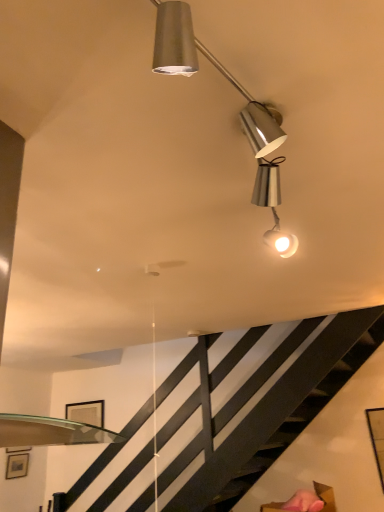
What is the approximate width of metallic silver lamp at upper center?

8.19 inches.

At what (x,y) coordinates should I click in order to perform the action: click on matte black picture frame at lower left, acting as the second picture frame starting from the right. Please return your answer as a coordinate pair (x, y). This screenshot has width=384, height=512. Looking at the image, I should click on (17, 465).

This screenshot has height=512, width=384. What are the coordinates of `metallic silver lamp at upper center` in the screenshot? It's located at (240, 112).

In terms of size, does matte black picture frame at lower left, arranged as the second picture frame when viewed from the top, appear bigger or smaller than matte black picture frame at upper center, which appears as the first picture frame when viewed from the back?

Considering their sizes, matte black picture frame at lower left, arranged as the second picture frame when viewed from the top, takes up less space than matte black picture frame at upper center, which appears as the first picture frame when viewed from the back.

From the image's perspective, which is above, matte black picture frame at lower left, acting as the second picture frame starting from the right, or matte black picture frame at upper center, which is counted as the 2th picture frame, starting from the front?

matte black picture frame at upper center, which is counted as the 2th picture frame, starting from the front, is shown above in the image.

Is matte black picture frame at lower left, the first picture frame in the bottom-to-top sequence, beside matte black picture frame at upper center, which appears as the first picture frame when viewed from the back?

No, matte black picture frame at lower left, the first picture frame in the bottom-to-top sequence, is not touching matte black picture frame at upper center, which appears as the first picture frame when viewed from the back.

From a real-world perspective, which object rests below the other?

matte black picture frame at lower left, acting as the second picture frame starting from the right.

How different are the orientations of matte black picture frame at upper center, which is counted as the 2th picture frame, starting from the bottom, and matte black picture frame at lower left, acting as the second picture frame starting from the right, in degrees?

They differ by 92 degrees in their facing directions.

Is point (87, 413) closer or farther from the camera than point (28, 456)?

Point (87, 413).

Does matte black picture frame at upper center, which is the 2th picture frame from left to right, appear on the left side of matte black picture frame at lower left, arranged as the second picture frame when viewed from the top?

Incorrect, matte black picture frame at upper center, which is the 2th picture frame from left to right, is not on the left side of matte black picture frame at lower left, arranged as the second picture frame when viewed from the top.

Looking at this image, from the image's perspective, which is below, matte black picture frame at upper center, which is the 2th picture frame from left to right, or matte black picture frame at lower left, the first picture frame in the bottom-to-top sequence?

matte black picture frame at lower left, the first picture frame in the bottom-to-top sequence.

From the picture: Considering the positions of objects matte black picture frame at lower left, the first picture frame in the bottom-to-top sequence, and metallic silver lamp at upper center in the image provided, who is behind, matte black picture frame at lower left, the first picture frame in the bottom-to-top sequence, or metallic silver lamp at upper center?

matte black picture frame at lower left, the first picture frame in the bottom-to-top sequence, is further from the camera.

Considering the sizes of objects matte black picture frame at lower left, acting as the second picture frame starting from the right, and metallic silver lamp at upper center in the image provided, who is wider, matte black picture frame at lower left, acting as the second picture frame starting from the right, or metallic silver lamp at upper center?

With larger width is metallic silver lamp at upper center.

Is matte black picture frame at lower left, the first picture frame in the bottom-to-top sequence, facing away from metallic silver lamp at upper center?

No.

Do you think matte black picture frame at lower left, the first picture frame in the bottom-to-top sequence, is within metallic silver lamp at upper center, or outside of it?

matte black picture frame at lower left, the first picture frame in the bottom-to-top sequence, cannot be found inside metallic silver lamp at upper center.

Considering the positions of objects matte black picture frame at upper center, the first picture frame viewed from the top, and metallic silver lamp at upper center in the image provided, who is more to the left, matte black picture frame at upper center, the first picture frame viewed from the top, or metallic silver lamp at upper center?

Positioned to the left is matte black picture frame at upper center, the first picture frame viewed from the top.

Is point (83, 415) less distant than point (282, 130)?

No, it is not.

From the image's perspective, which one is positioned lower, matte black picture frame at upper center, the first picture frame viewed from the top, or metallic silver lamp at upper center?

matte black picture frame at upper center, the first picture frame viewed from the top, is shown below in the image.

Based on their sizes in the image, would you say matte black picture frame at upper center, which is counted as the 2th picture frame, starting from the front, is bigger or smaller than metallic silver lamp at upper center?

Considering their sizes, matte black picture frame at upper center, which is counted as the 2th picture frame, starting from the front, takes up less space than metallic silver lamp at upper center.

Which of these two, metallic silver lamp at upper center or matte black picture frame at upper center, the first picture frame positioned from the right, is wider?

metallic silver lamp at upper center is wider.

Is metallic silver lamp at upper center next to matte black picture frame at upper center, which is counted as the 2th picture frame, starting from the front?

No, metallic silver lamp at upper center is not next to matte black picture frame at upper center, which is counted as the 2th picture frame, starting from the front.

Considering the relative sizes of metallic silver lamp at upper center and matte black picture frame at upper center, which is the 2th picture frame from left to right, in the image provided, is metallic silver lamp at upper center shorter than matte black picture frame at upper center, which is the 2th picture frame from left to right,?

Indeed, metallic silver lamp at upper center has a lesser height compared to matte black picture frame at upper center, which is the 2th picture frame from left to right.

Consider the image. Which object is positioned more to the right, metallic silver lamp at upper center or matte black picture frame at upper center, which is the 2th picture frame from left to right?

Positioned to the right is metallic silver lamp at upper center.

Can you confirm if metallic silver lamp at upper center is shorter than matte black picture frame at lower left, which is the first picture frame in left-to-right order?

Yes.

Is metallic silver lamp at upper center positioned with its back to matte black picture frame at lower left, which is counted as the first picture frame, starting from the front?

No, metallic silver lamp at upper center's orientation is not away from matte black picture frame at lower left, which is counted as the first picture frame, starting from the front.

Considering the relative positions of metallic silver lamp at upper center and matte black picture frame at lower left, which is counted as the first picture frame, starting from the front, in the image provided, is metallic silver lamp at upper center to the left or to the right of matte black picture frame at lower left, which is counted as the first picture frame, starting from the front,?

metallic silver lamp at upper center is to the right of matte black picture frame at lower left, which is counted as the first picture frame, starting from the front.

Based on the photo, considering the positions of objects metallic silver lamp at upper center and matte black picture frame at lower left, the first picture frame in the bottom-to-top sequence, in the image provided, who is behind, metallic silver lamp at upper center or matte black picture frame at lower left, the first picture frame in the bottom-to-top sequence,?

matte black picture frame at lower left, the first picture frame in the bottom-to-top sequence, is more distant.

Image resolution: width=384 pixels, height=512 pixels. Find the location of `picture frame located on the left of matte black picture frame at upper center, the first picture frame viewed from the top`. picture frame located on the left of matte black picture frame at upper center, the first picture frame viewed from the top is located at coordinates (17, 465).

I want to click on picture frame that appears above the matte black picture frame at lower left, which is counted as the first picture frame, starting from the front (from a real-world perspective), so click(x=86, y=412).

Considering their positions, is metallic silver lamp at upper center positioned closer to matte black picture frame at upper center, which is counted as the 2th picture frame, starting from the front, than matte black picture frame at lower left, the 2th picture frame in the back-to-front sequence?

The object closer to matte black picture frame at upper center, which is counted as the 2th picture frame, starting from the front, is matte black picture frame at lower left, the 2th picture frame in the back-to-front sequence.

Which object lies further to the anchor point matte black picture frame at lower left, the first picture frame in the bottom-to-top sequence, matte black picture frame at upper center, the first picture frame positioned from the right, or metallic silver lamp at upper center?

metallic silver lamp at upper center lies further to matte black picture frame at lower left, the first picture frame in the bottom-to-top sequence, than the other object.

Based on their spatial positions, is matte black picture frame at upper center, which is counted as the 2th picture frame, starting from the front, or matte black picture frame at lower left, which is counted as the first picture frame, starting from the front, closer to metallic silver lamp at upper center?

Based on the image, matte black picture frame at upper center, which is counted as the 2th picture frame, starting from the front, appears to be nearer to metallic silver lamp at upper center.

When comparing their distances from matte black picture frame at lower left, arranged as the second picture frame when viewed from the top, does metallic silver lamp at upper center or matte black picture frame at upper center, which appears as the first picture frame when viewed from the back, seem further?

metallic silver lamp at upper center is further to matte black picture frame at lower left, arranged as the second picture frame when viewed from the top.

From the image, which object appears to be farther from metallic silver lamp at upper center, matte black picture frame at lower left, which is the first picture frame in left-to-right order, or matte black picture frame at upper center, the first picture frame viewed from the top?

matte black picture frame at lower left, which is the first picture frame in left-to-right order.

Based on their spatial positions, is matte black picture frame at lower left, which is counted as the first picture frame, starting from the front, or metallic silver lamp at upper center closer to matte black picture frame at upper center, which is counted as the 2th picture frame, starting from the bottom?

The object closer to matte black picture frame at upper center, which is counted as the 2th picture frame, starting from the bottom, is matte black picture frame at lower left, which is counted as the first picture frame, starting from the front.

Where is `picture frame between metallic silver lamp at upper center and matte black picture frame at upper center, which is counted as the 2th picture frame, starting from the bottom, from front to back`? picture frame between metallic silver lamp at upper center and matte black picture frame at upper center, which is counted as the 2th picture frame, starting from the bottom, from front to back is located at coordinates (17, 465).